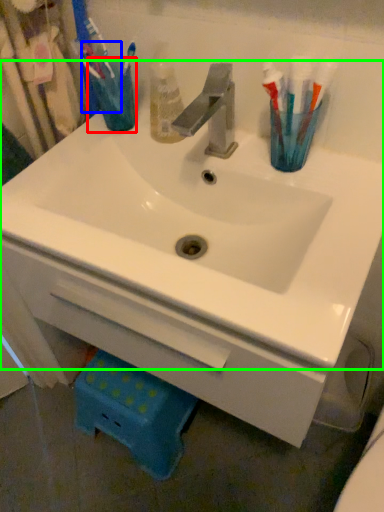
Question: Which is farther away from turquoise (highlighted by a red box)? toothbrush (highlighted by a blue box) or sink (highlighted by a green box)?

Choices:
 (A) toothbrush
 (B) sink

Answer: (B)